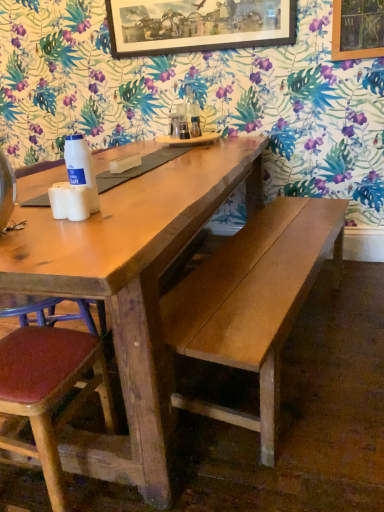
Question: Considering the relative positions of wooden tray at center and wooden bench at center in the image provided, is wooden tray at center to the left of wooden bench at center from the viewer's perspective?

Choices:
 (A) no
 (B) yes

Answer: (B)

Question: Considering the relative sizes of wooden tray at center and wooden bench at center in the image provided, is wooden tray at center smaller than wooden bench at center?

Choices:
 (A) yes
 (B) no

Answer: (A)

Question: Considering the relative sizes of wooden tray at center and wooden bench at center in the image provided, is wooden tray at center shorter than wooden bench at center?

Choices:
 (A) yes
 (B) no

Answer: (A)

Question: Is wooden tray at center to the right of wooden bench at center from the viewer's perspective?

Choices:
 (A) yes
 (B) no

Answer: (B)

Question: From a real-world perspective, is wooden tray at center physically above wooden bench at center?

Choices:
 (A) yes
 (B) no

Answer: (A)

Question: Is brown wood chair at lower left to the left or to the right of wooden framed artwork at upper center in the image?

Choices:
 (A) left
 (B) right

Answer: (A)

Question: Choose the correct answer: Is brown wood chair at lower left inside wooden framed artwork at upper center or outside it?

Choices:
 (A) inside
 (B) outside

Answer: (B)

Question: Is point (41, 312) positioned closer to the camera than point (221, 12)?

Choices:
 (A) farther
 (B) closer

Answer: (B)

Question: Is brown wood chair at lower left taller or shorter than wooden framed artwork at upper center?

Choices:
 (A) tall
 (B) short

Answer: (A)

Question: Looking at the image, does brown wood chair at lower left seem bigger or smaller compared to wooden tray at center?

Choices:
 (A) small
 (B) big

Answer: (B)

Question: Considering the positions of point (23, 309) and point (155, 138), is point (23, 309) closer or farther from the camera than point (155, 138)?

Choices:
 (A) farther
 (B) closer

Answer: (B)

Question: From the image's perspective, relative to wooden tray at center, is brown wood chair at lower left above or below?

Choices:
 (A) below
 (B) above

Answer: (A)

Question: Relative to wooden tray at center, is brown wood chair at lower left in front or behind?

Choices:
 (A) front
 (B) behind

Answer: (A)

Question: Which is correct: white matte salt shaker at left is inside wooden tray at center, or outside of it?

Choices:
 (A) outside
 (B) inside

Answer: (A)

Question: From a real-world perspective, is white matte salt shaker at left positioned above or below wooden tray at center?

Choices:
 (A) above
 (B) below

Answer: (A)